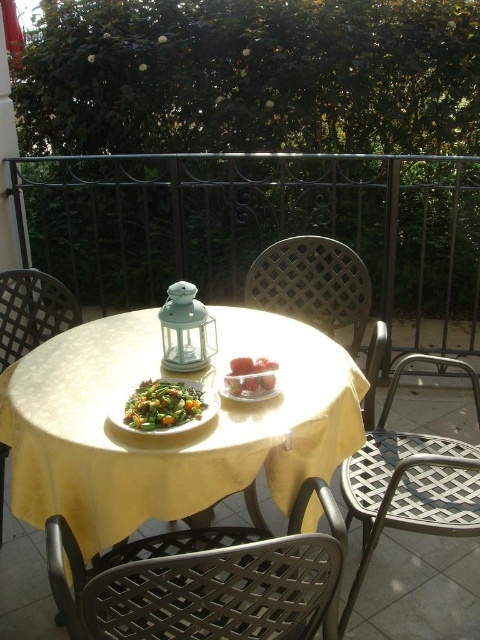
Can you confirm if metallic lattice chair at lower right is shorter than smooth glass bowl at center?

No, metallic lattice chair at lower right is not shorter than smooth glass bowl at center.

Describe the element at coordinates (410, 481) in the screenshot. I see `metallic lattice chair at lower right` at that location.

Image resolution: width=480 pixels, height=640 pixels. Identify the location of metallic lattice chair at lower right. (410, 481).

Does yellow fabric table at center have a lesser width compared to metallic mesh chair at left?

No, yellow fabric table at center is not thinner than metallic mesh chair at left.

Who is taller, yellow fabric table at center or metallic mesh chair at left?

Standing taller between the two is yellow fabric table at center.

Between point (82, 336) and point (26, 305), which one is positioned behind?

The point (26, 305) is more distant.

The width and height of the screenshot is (480, 640). I want to click on yellow fabric table at center, so click(x=168, y=438).

Which of these two, metallic lattice chair at lower right or metallic lattice chair at center, stands taller?

metallic lattice chair at lower right

From the picture: Is metallic lattice chair at lower right shorter than metallic lattice chair at center?

In fact, metallic lattice chair at lower right may be taller than metallic lattice chair at center.

I want to click on metallic lattice chair at lower right, so click(410, 481).